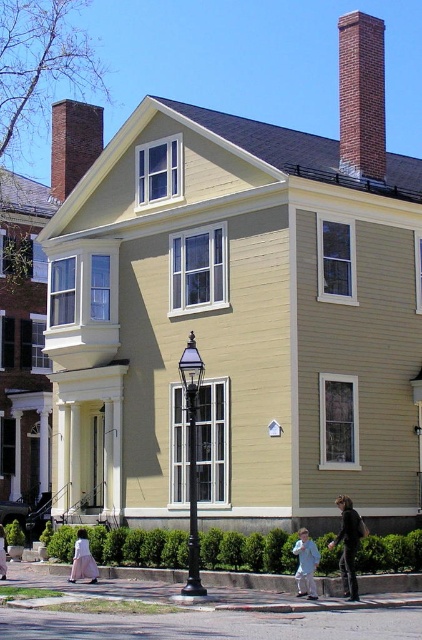
Between brick chimney at upper right and black wrought iron streetlight at center, which one has less height?

black wrought iron streetlight at center is shorter.

Looking at this image, is brick chimney at upper right further to the viewer compared to black wrought iron streetlight at center?

That is True.

The height and width of the screenshot is (640, 422). What do you see at coordinates (362, 96) in the screenshot? I see `brick chimney at upper right` at bounding box center [362, 96].

You are a GUI agent. You are given a task and a screenshot of the screen. Output one action in this format:
    pyautogui.click(x=<x>, y=<y>)
    Task: Click on the brick chimney at upper right
    
    Given the screenshot: What is the action you would take?
    (362, 96)

Can you confirm if brick chimney at upper right is smaller than light blue fabric child at lower center?

No, brick chimney at upper right is not smaller than light blue fabric child at lower center.

Is brick chimney at upper right below light blue fabric child at lower center?

No.

What do you see at coordinates (362, 96) in the screenshot?
I see `brick chimney at upper right` at bounding box center [362, 96].

Image resolution: width=422 pixels, height=640 pixels. I want to click on brick chimney at upper right, so pos(362,96).

Between point (370, 108) and point (56, 104), which one is positioned in front?

Point (370, 108)

In the scene shown: Who is taller, brick chimney at upper right or brick chimney at upper center?

brick chimney at upper right

Measure the distance between point (351,115) and camera.

Point (351,115) and camera are 164.59 feet apart from each other.

Where is `brick chimney at upper right`? The image size is (422, 640). brick chimney at upper right is located at coordinates (362, 96).